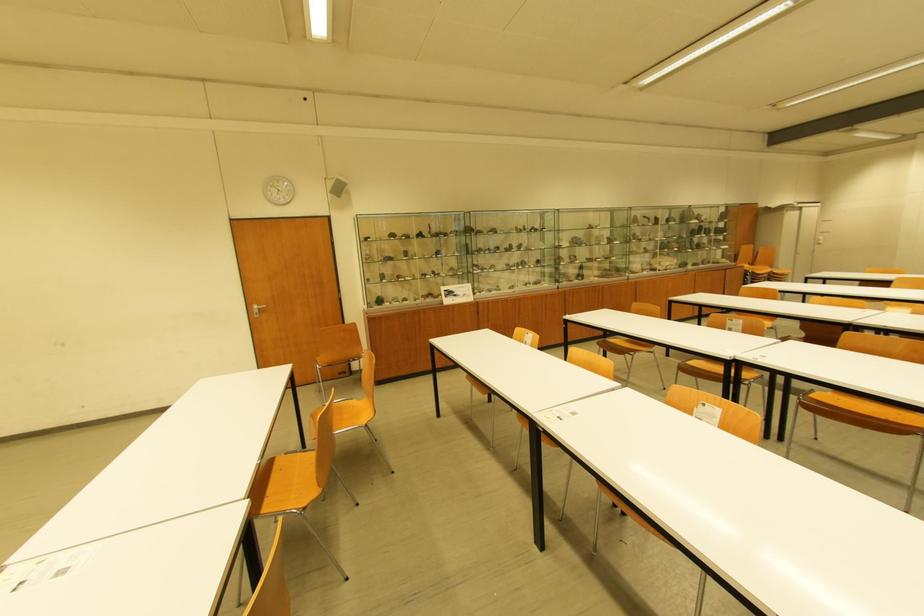
What do you see at coordinates (257, 310) in the screenshot?
I see `the silver door handle` at bounding box center [257, 310].